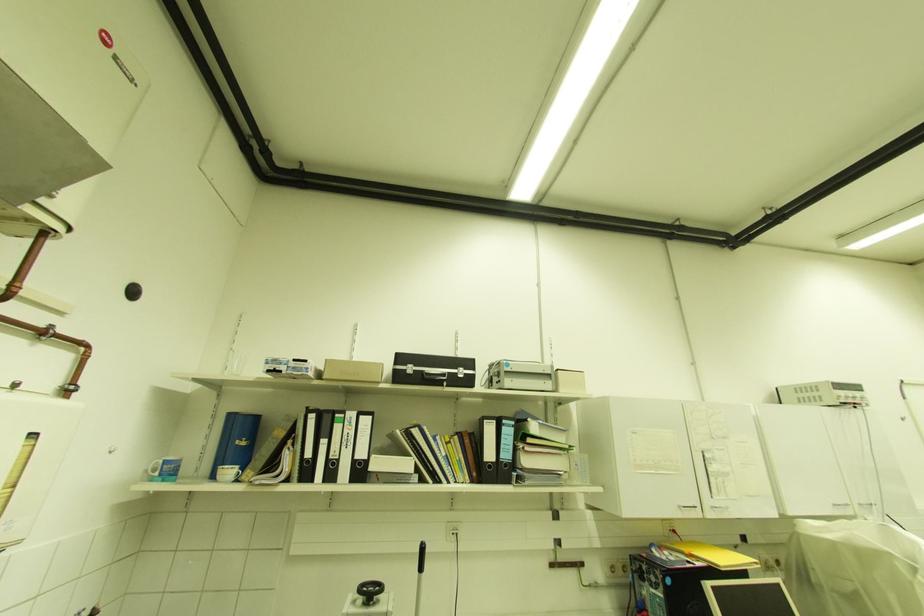
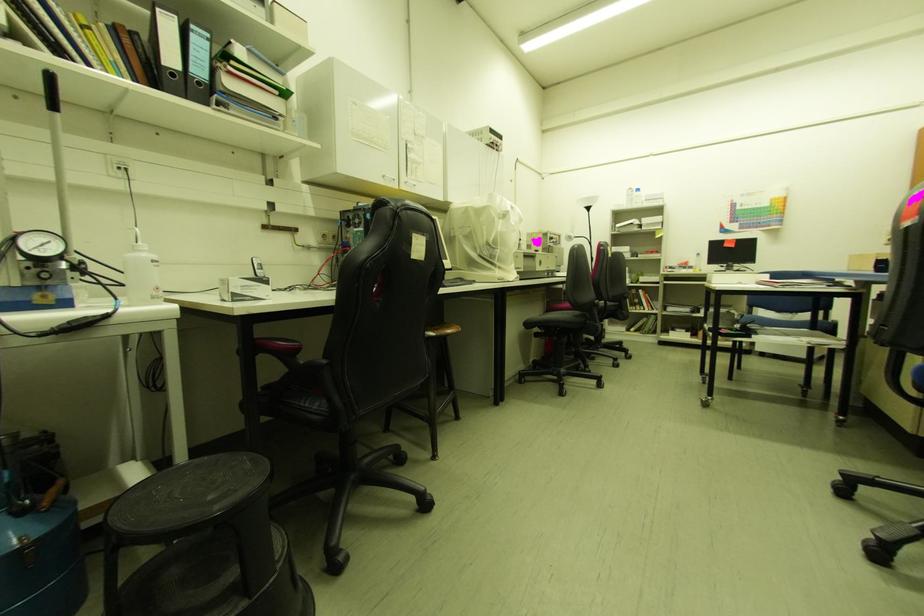
First-person continuous shooting, in which direction is the camera rotating?

The camera's rotation is toward right-down.